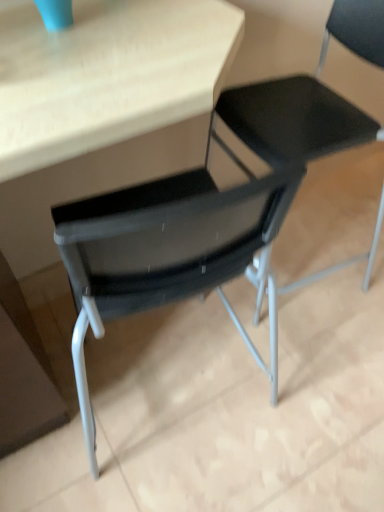
Find the location of a particular element. vacant space in front of black mesh chair at center, the second chair in the right-to-left sequence is located at coordinates (x=327, y=362).